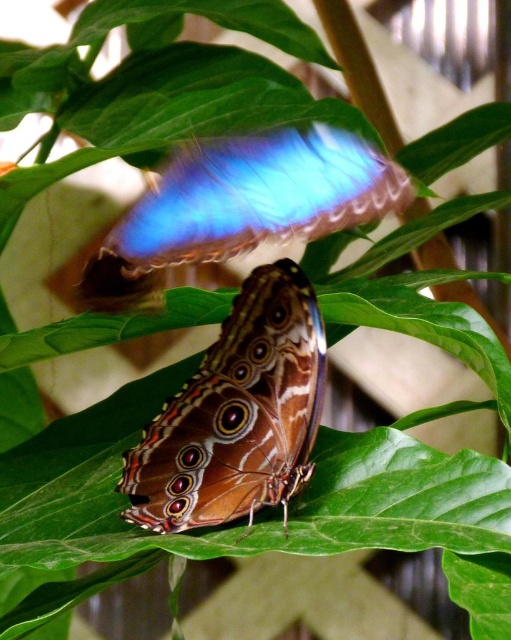
Is brown textured butterfly at center bigger than blue iridescent wing at upper center?

No.

Between brown textured butterfly at center and blue iridescent wing at upper center, which one is positioned higher?

blue iridescent wing at upper center is above.

Which is behind, point (280, 278) or point (243, 214)?

The point (280, 278) is behind.

You are a GUI agent. You are given a task and a screenshot of the screen. Output one action in this format:
    pyautogui.click(x=<x>, y=<y>)
    Task: Click on the brown textured butterfly at center
    This screenshot has height=640, width=511.
    Given the screenshot: What is the action you would take?
    pyautogui.click(x=237, y=413)